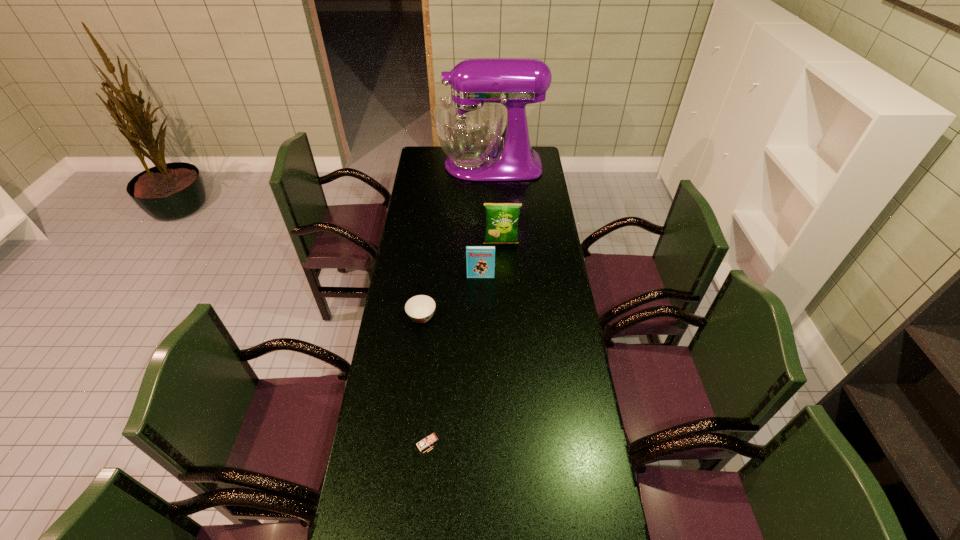
Image resolution: width=960 pixels, height=540 pixels. Identify the location of object that is positioned at the far left corner. (469, 124).

Find the location of a particular element. The image size is (960, 540). object that is positioned at the far right corner is located at coordinates (469, 124).

You are a GUI agent. You are given a task and a screenshot of the screen. Output one action in this format:
    pyautogui.click(x=<x>, y=<y>)
    Task: Click on the blank space at the left edge
    
    Given the screenshot: What is the action you would take?
    pyautogui.click(x=389, y=484)

This screenshot has height=540, width=960. What are the coordinates of `free space at the right edge of the desktop` in the screenshot? It's located at (527, 221).

The height and width of the screenshot is (540, 960). I want to click on vacant area that lies between the second nearest object and the matchbox, so click(424, 380).

Image resolution: width=960 pixels, height=540 pixels. Identify the location of free space between the fourth farthest object and the third farthest object. (451, 297).

I want to click on empty space between the third tallest object and the tallest object, so click(485, 221).

Where is `free spot between the fourth farthest object and the nearest object`? This screenshot has width=960, height=540. free spot between the fourth farthest object and the nearest object is located at coordinates (424, 380).

Find the location of `vacant area that lies between the shortest object and the third nearest object`. vacant area that lies between the shortest object and the third nearest object is located at coordinates (451, 297).

Where is `free space between the crisp (potato chip) and the nearest object`? free space between the crisp (potato chip) and the nearest object is located at coordinates click(x=465, y=343).